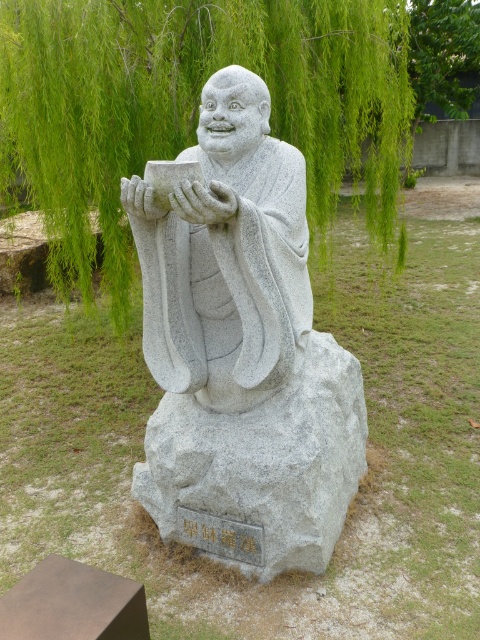
You are a photographer standing at a certain distance from the gray stone statue at center. You want to capture a full view of the statue in your photo without any cropping. Your camera has a standard lens with a focal length of 50mm. According to the rule of thumb, the minimum distance you should stand from the statue to avoid distortion is 1.5 times its height. If the statue is 2 meters tall, can you safely take the photo from your current position?

The gray stone statue at center is 2.44 meters from camera. Since the statue is 2 meters tall, the minimum safe distance is 1.5 times its height, which is 3 meters. Since you are only 2.44 meters away, you are too close and may experience distortion. Move back to at least 3 meters for a distortion free photo.